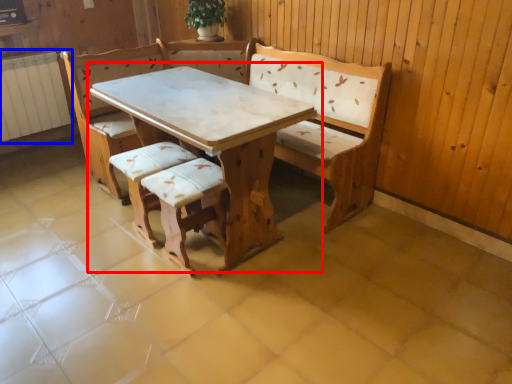
Question: Which of the following is the farthest to the observer, table (highlighted by a red box) or radiator (highlighted by a blue box)?

Choices:
 (A) table
 (B) radiator

Answer: (B)